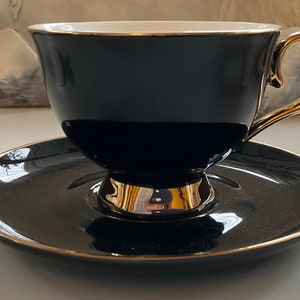
At what (x,y) coordinates should I click in order to perform the action: click on tea cup. Please return your answer as a coordinate pair (x, y). Image resolution: width=300 pixels, height=300 pixels. Looking at the image, I should click on (169, 166).